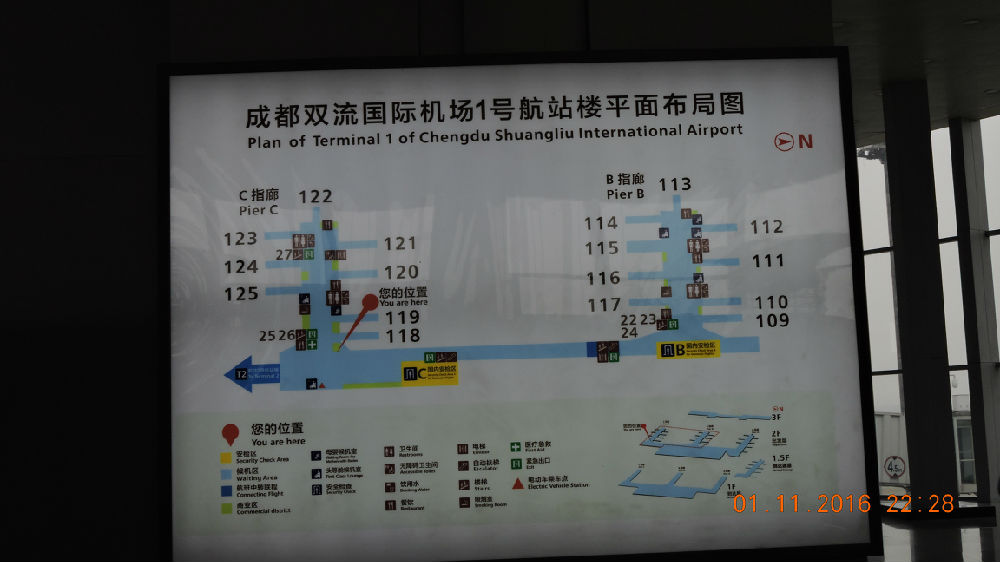
The width and height of the screenshot is (1000, 562). I want to click on tv frame right, so click(858, 271).